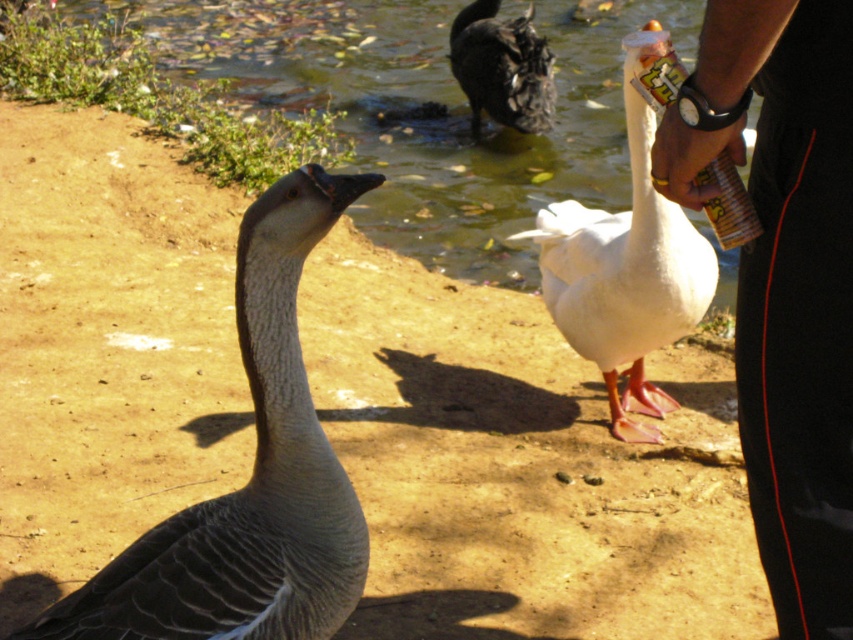
Question: Considering the relative positions of gray feathered goose at center and white matte goose at center in the image provided, where is gray feathered goose at center located with respect to white matte goose at center?

Choices:
 (A) below
 (B) above

Answer: (A)

Question: Which point is closer to the camera?

Choices:
 (A) (527, 236)
 (B) (834, 196)
 (C) (317, 236)
 (D) (732, 250)

Answer: (B)

Question: Does greenish water at center lie in front of black fabric pants at right?

Choices:
 (A) yes
 (B) no

Answer: (B)

Question: Is greenish water at center bigger than white matte goose at center?

Choices:
 (A) no
 (B) yes

Answer: (B)

Question: Which point is closer to the camera taking this photo?

Choices:
 (A) (688, 292)
 (B) (782, 20)
 (C) (454, 252)
 (D) (554, 102)

Answer: (B)

Question: Among these objects, which one is nearest to the camera?

Choices:
 (A) white matte goose at center
 (B) black fabric pants at right

Answer: (B)